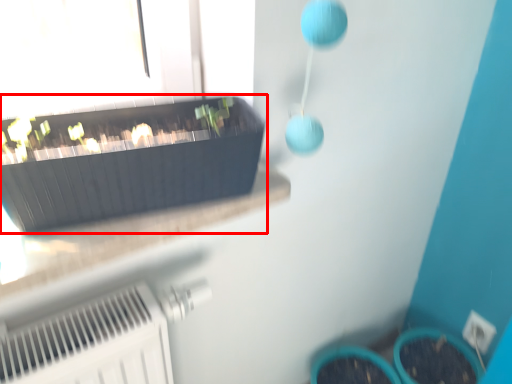
Question: From the image's perspective, what is the correct spatial positioning of flowerpot (annotated by the red box) in reference to electric outlet?

Choices:
 (A) below
 (B) above

Answer: (B)